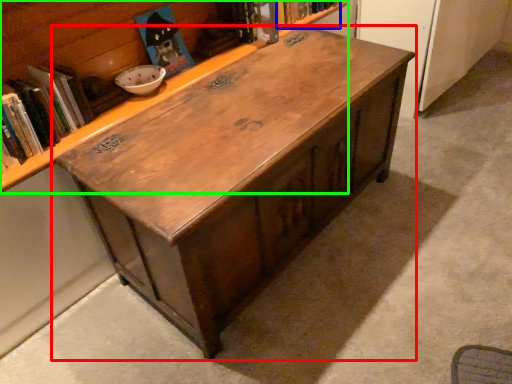
Question: Estimate the real-world distances between objects in this image. Which object is closer to table (highlighted by a red box), book (highlighted by a blue box) or bookcase (highlighted by a green box)?

Choices:
 (A) book
 (B) bookcase

Answer: (B)